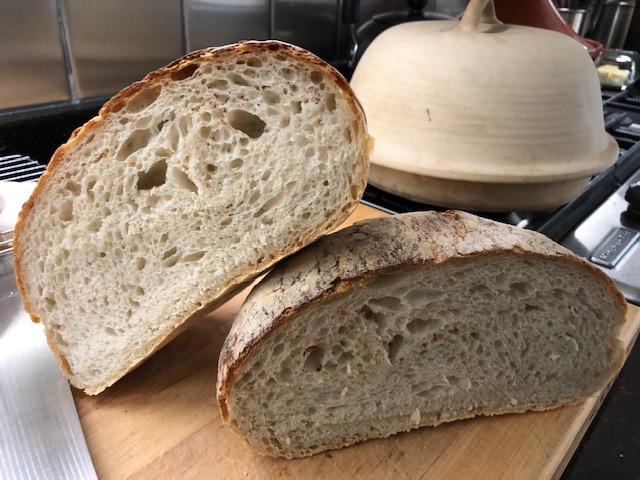
I want to click on burner, so click(618, 121).